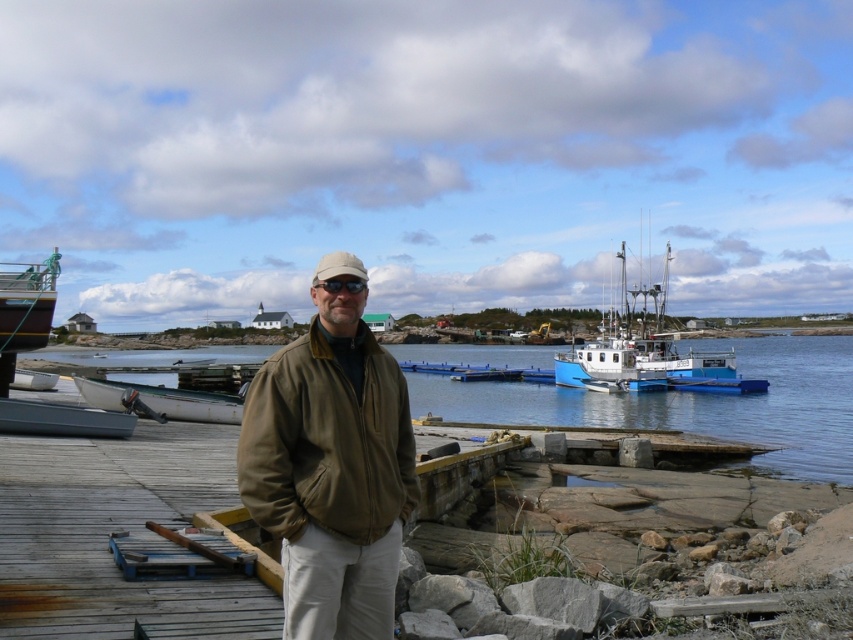
Question: Does white matte boat at left have a smaller size compared to beige fabric baseball cap at center?

Choices:
 (A) yes
 (B) no

Answer: (A)

Question: Which point is farther from the camera taking this photo?

Choices:
 (A) (660, 314)
 (B) (99, 392)
 (C) (328, 285)

Answer: (A)

Question: Can you confirm if olive-green jacket at center is wider than white plastic boat at lower left?

Choices:
 (A) yes
 (B) no

Answer: (B)

Question: Is wooden dock at center wider than beige fabric baseball cap at center?

Choices:
 (A) no
 (B) yes

Answer: (B)

Question: Which object is farther from the camera taking this photo?

Choices:
 (A) wooden dock at center
 (B) white matte boat at left
 (C) white matte boat at center
 (D) black matte sunglasses at center

Answer: (C)

Question: Estimate the real-world distances between objects in this image. Which object is farther from the beige fabric baseball cap at center?

Choices:
 (A) wooden dock at center
 (B) olive-green jacket at center
 (C) white matte boat at center
 (D) clear water at dock center

Answer: (D)